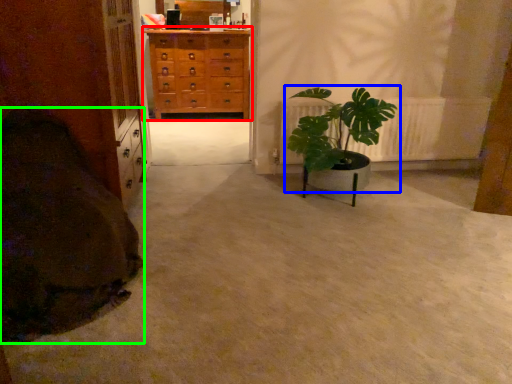
Question: Which object is positioned closest to chest of drawers (highlighted by a red box)? Select from houseplant (highlighted by a blue box) and blanket (highlighted by a green box).

Choices:
 (A) houseplant
 (B) blanket

Answer: (A)